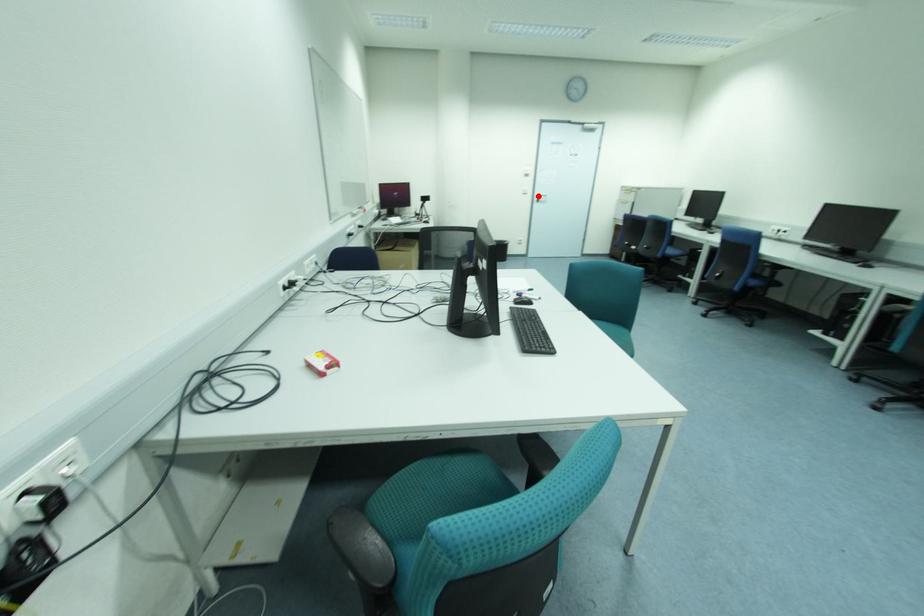
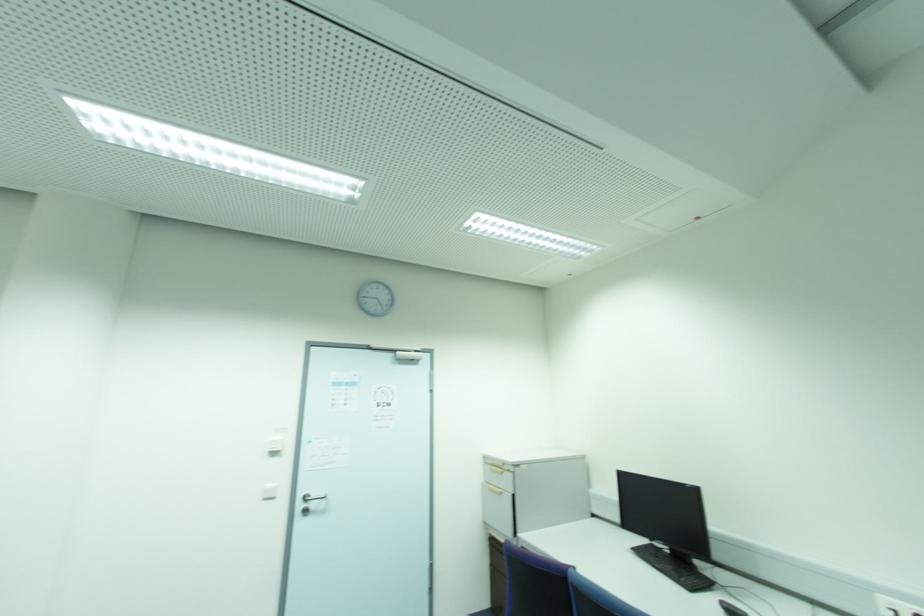
Question: I am providing you with two images of the same scene from different viewpoints. Image1 has a red point marked. In image2, the corresponding 3D location appears at what relative position? Reply with the corresponding letter.

Choices:
 (A) Closer
 (B) Farther

Answer: (B)